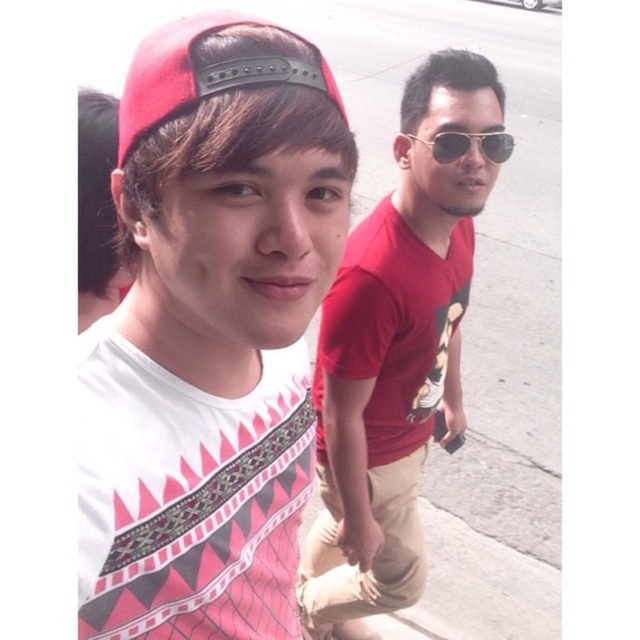
Does matte red t-shirt at center have a larger size compared to matte red baseball cap at upper left?

Correct, matte red t-shirt at center is larger in size than matte red baseball cap at upper left.

Between point (420, 420) and point (156, 104), which one is positioned in front?

Point (156, 104)

The height and width of the screenshot is (640, 640). Identify the location of matte red t-shirt at center. (396, 353).

Between matte pink cap at upper left and matte red baseball cap at upper left, which one has less height?

matte red baseball cap at upper left is shorter.

Can you confirm if matte pink cap at upper left is positioned above matte red baseball cap at upper left?

Actually, matte pink cap at upper left is below matte red baseball cap at upper left.

Identify the location of matte pink cap at upper left. Image resolution: width=640 pixels, height=640 pixels. (211, 333).

This screenshot has height=640, width=640. What are the coordinates of `matte pink cap at upper left` in the screenshot? It's located at (211, 333).

Is matte red baseball cap at upper left wider than sunglasses at center?

Yes.

Find the location of a particular element. This screenshot has height=640, width=640. matte red baseball cap at upper left is located at coordinates (204, 74).